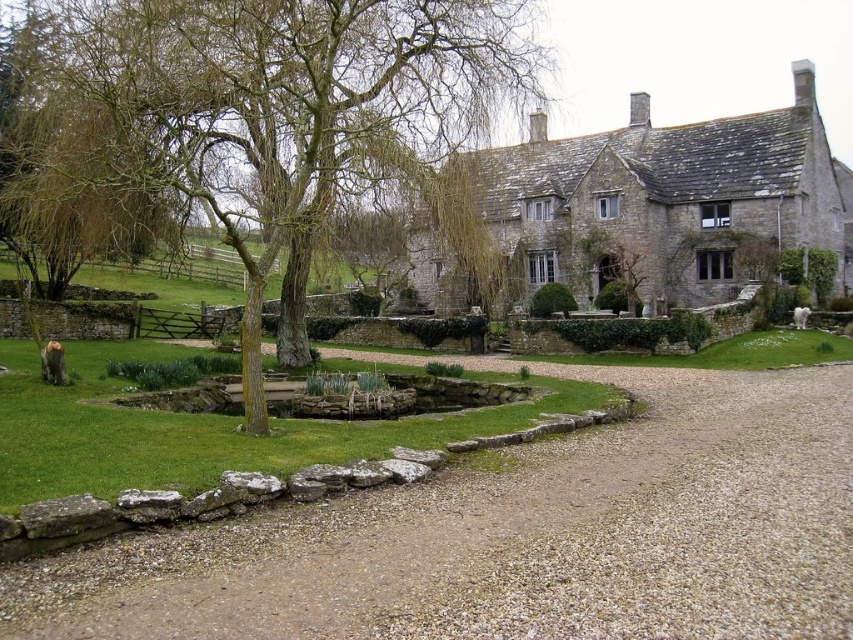
Does gray gravel at center have a lesser width compared to green leafy tree at upper left?

Correct, gray gravel at center's width is less than green leafy tree at upper left's.

What are the coordinates of `gray gravel at center` in the screenshot? It's located at (518, 538).

Find the location of a particular element. This screenshot has height=640, width=853. gray gravel at center is located at coordinates (518, 538).

Does gray gravel at center appear on the right side of white fluffy dog at lower right?

In fact, gray gravel at center is to the left of white fluffy dog at lower right.

What do you see at coordinates (518, 538) in the screenshot?
I see `gray gravel at center` at bounding box center [518, 538].

At what (x,y) coordinates should I click in order to perform the action: click on gray gravel at center. Please return your answer as a coordinate pair (x, y). This screenshot has height=640, width=853. Looking at the image, I should click on (518, 538).

From the picture: Who is higher up, green leafy tree at upper left or white fluffy dog at lower right?

green leafy tree at upper left

You are a GUI agent. You are given a task and a screenshot of the screen. Output one action in this format:
    pyautogui.click(x=<x>, y=<y>)
    Task: Click on the green leafy tree at upper left
    The width and height of the screenshot is (853, 640).
    Given the screenshot: What is the action you would take?
    pyautogui.click(x=262, y=109)